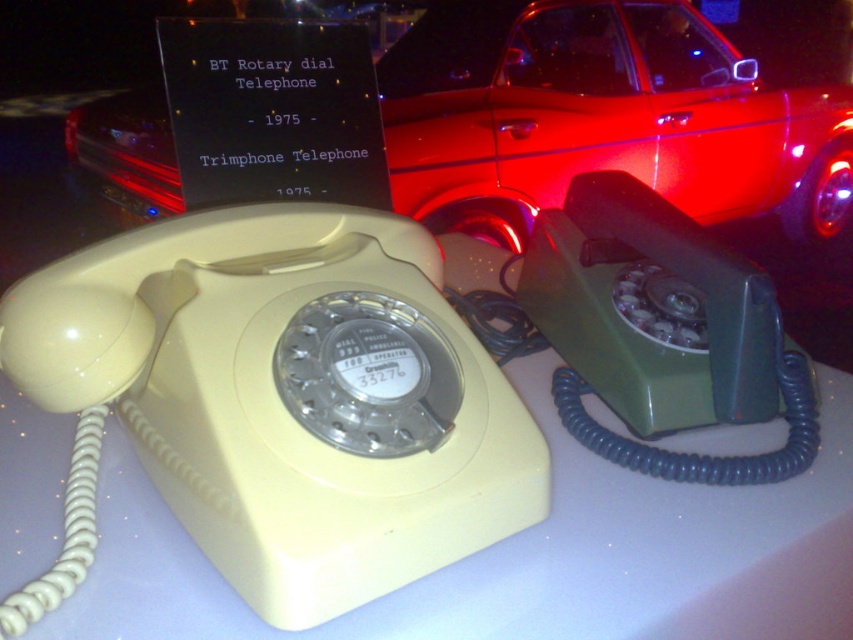
Which is more to the right, white plastic table at center or matte green rotary dial telephone at right?

Positioned to the right is matte green rotary dial telephone at right.

Does white plastic table at center appear under matte green rotary dial telephone at right?

Yes, white plastic table at center is below matte green rotary dial telephone at right.

Where is `white plastic table at center`? The height and width of the screenshot is (640, 853). white plastic table at center is located at coordinates (349, 449).

Find the location of a particular element. The height and width of the screenshot is (640, 853). white plastic table at center is located at coordinates (349, 449).

Is the position of metallic red car at upper center more distant than that of matte green rotary dial telephone at right?

Yes, metallic red car at upper center is further from the viewer.

Can you confirm if metallic red car at upper center is positioned to the right of matte green rotary dial telephone at right?

Indeed, metallic red car at upper center is positioned on the right side of matte green rotary dial telephone at right.

Between point (837, 221) and point (676, 369), which one is positioned behind?

The point (837, 221) is more distant.

Locate an element on the screen. Image resolution: width=853 pixels, height=640 pixels. metallic red car at upper center is located at coordinates (602, 118).

How distant is white plastic table at center from metallic red car at upper center?

white plastic table at center is 1.60 meters away from metallic red car at upper center.

Which is behind, point (189, 387) or point (479, 60)?

The point (479, 60) is behind.

This screenshot has height=640, width=853. I want to click on white plastic table at center, so click(349, 449).